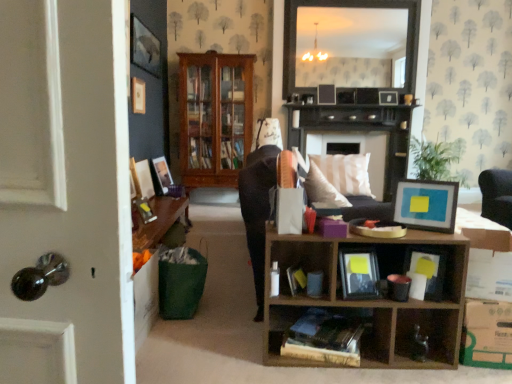
You are a GUI agent. You are given a task and a screenshot of the screen. Output one action in this format:
    pyautogui.click(x=<x>, y=<y>)
    Task: Click on the free spot below matte black picture frame at upper center, which appears as the 7th picture frame when viewed from the left (from a real-world perspective)
    This screenshot has width=512, height=384.
    Given the screenshot: What is the action you would take?
    pyautogui.click(x=388, y=110)